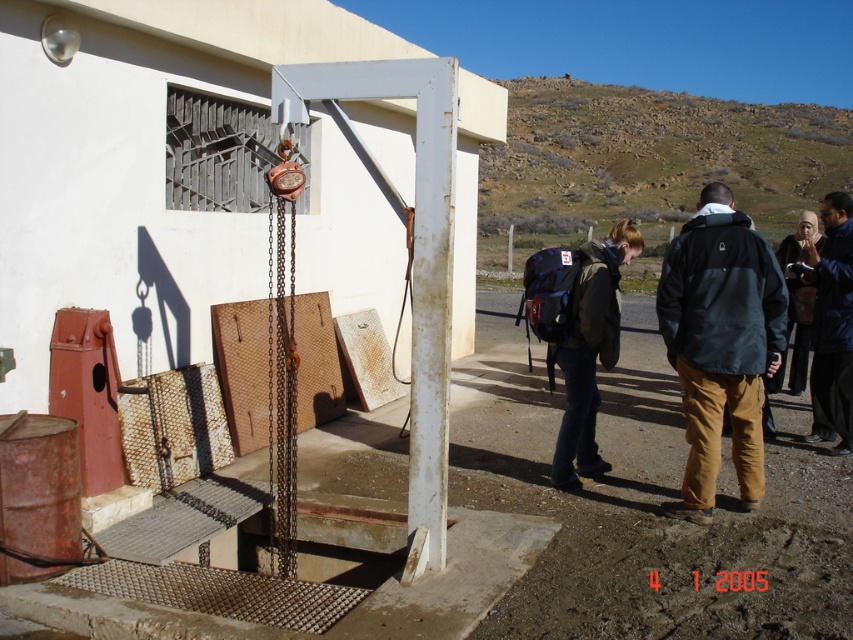
You are standing in front of the building with the metal structure. There are two points marked on the ground. The first point is at coordinate point (556, 456) and the second is at point (816, 324). If you want to place a heavy object closer to the metal structure, which point should you choose?

You should choose point (556, 456) because it is closer to the viewer than point (816, 324), meaning it is nearer to the metal structure.

You are a worker at the construction site shown in the image. You need to retrieve the matte green backpack at center to carry tools. However, the black fabric jacket at right is blocking your access to it. Can you lift the jacket to reach the backpack?

The black fabric jacket at right is positioned over the matte green backpack at center, so you can lift the jacket to access the backpack.

You are standing at the point labeled as point (590, 349) in the image. What object is located exactly at your current position?

The point (590, 349) indicates the location of the matte green backpack at center.